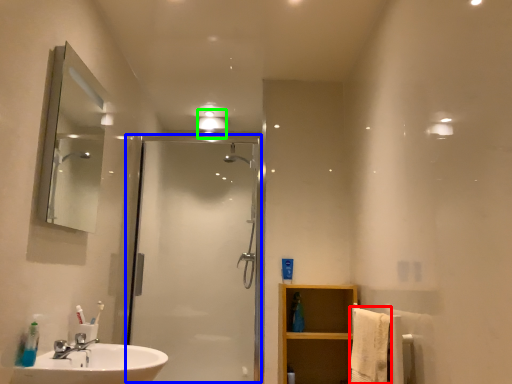
Question: Which object is the farthest from bath towel (highlighted by a red box)? Choose among these: screen door (highlighted by a blue box) or light fixture (highlighted by a green box).

Choices:
 (A) screen door
 (B) light fixture

Answer: (B)